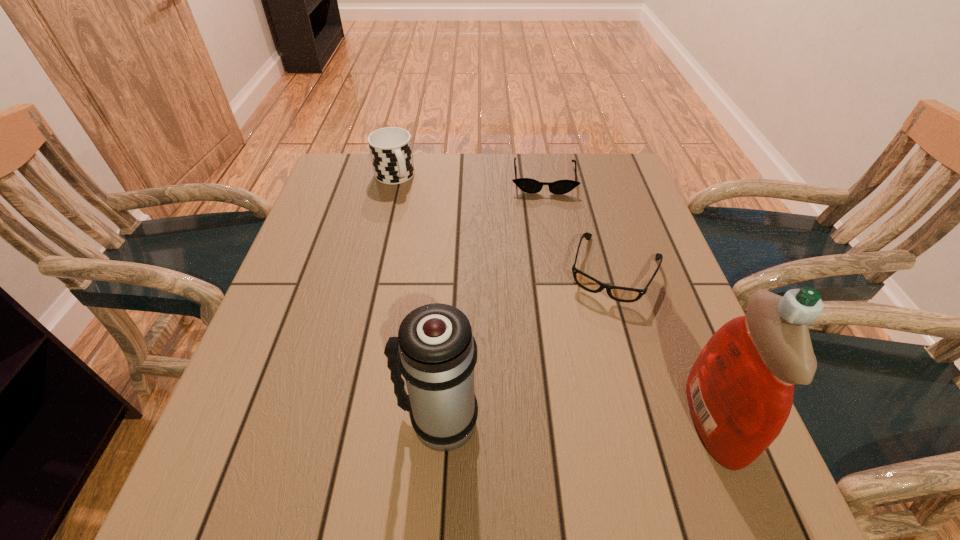
Where is `the second closest object to the cup`? This screenshot has height=540, width=960. the second closest object to the cup is located at coordinates coord(622,294).

Locate which object ranks third in proximity to the cup. Please provide its 2D coordinates. Your answer should be formatted as a tuple, i.e. [(x, y)], where the tuple contains the x and y coordinates of a point satisfying the conditions above.

[(435, 351)]

Identify the location of vacant region that satisfies the following two spatial constraints: 1. on the front side of the tallest object; 2. on the front surface of the shortest object. (586, 420).

At what (x,y) coordinates should I click in order to perform the action: click on vacant position in the image that satisfies the following two spatial constraints: 1. on the front side of the shortest object; 2. on the front surface of the detergent. Please return your answer as a coordinate pair (x, y). Looking at the image, I should click on (586, 420).